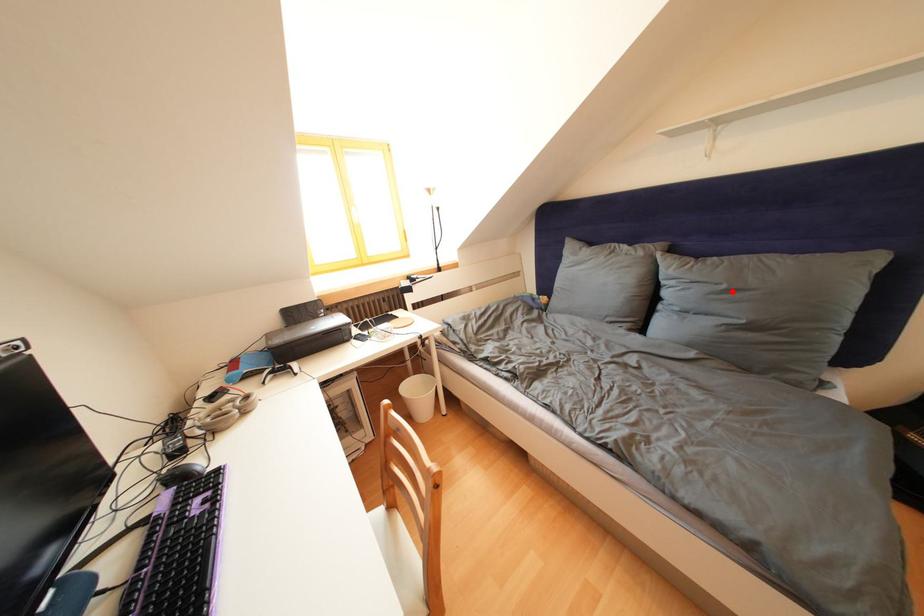
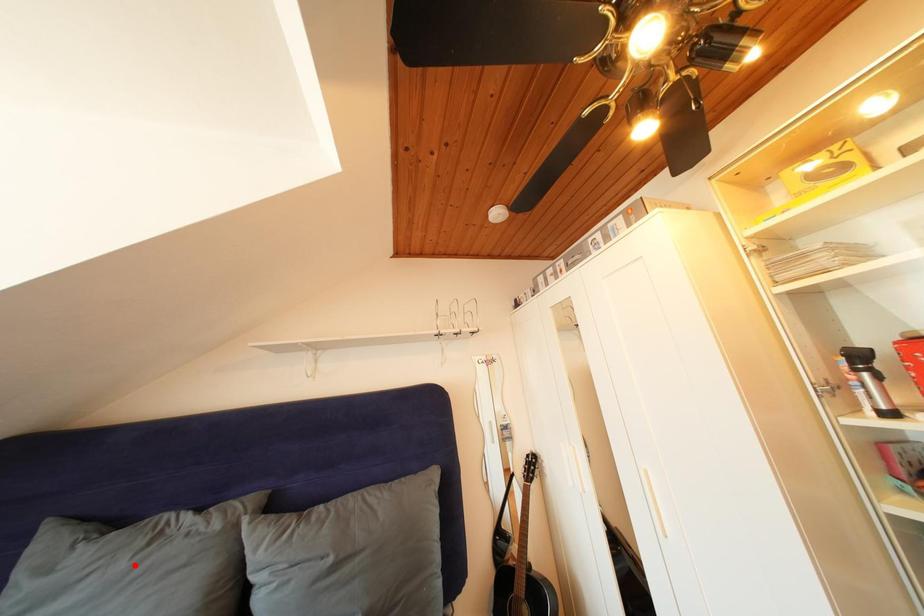
I am providing you with two images of the same scene from different viewpoints. A red point is marked on the first image and another point is marked on the second image. Do the highlighted points in image1 and image2 indicate the same real-world spot?

No